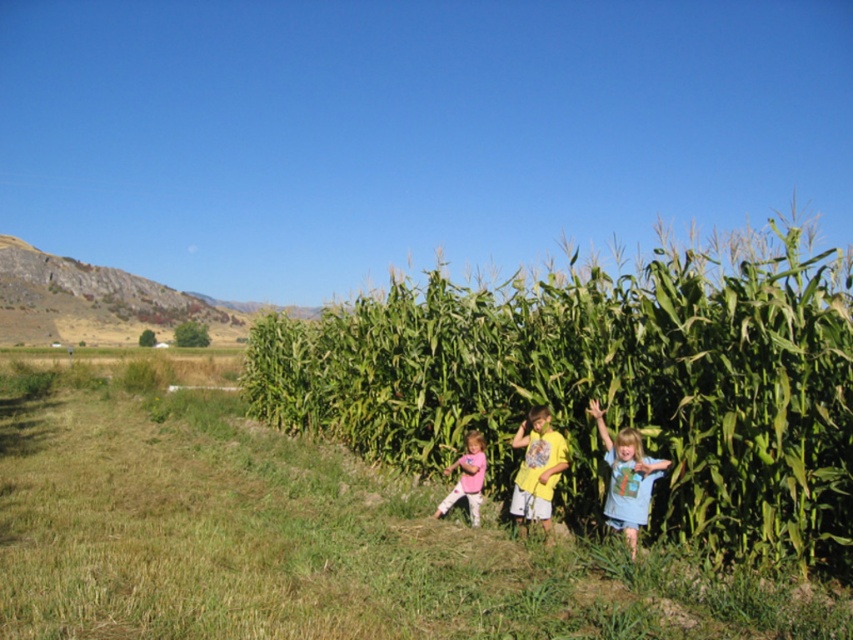
Between blue cotton shirt at right and yellow cotton shirt at center, which one is positioned lower?

Positioned lower is yellow cotton shirt at center.

Describe the element at coordinates (625, 477) in the screenshot. This screenshot has height=640, width=853. I see `blue cotton shirt at right` at that location.

Find the location of a particular element. This screenshot has width=853, height=640. blue cotton shirt at right is located at coordinates (625, 477).

Which of these two, green leafy corn at center or yellow cotton shirt at center, stands shorter?

yellow cotton shirt at center

Is point (788, 452) positioned behind point (526, 513)?

No, it is in front of (526, 513).

Does point (737, 554) come in front of point (514, 502)?

Yes.

You are a GUI agent. You are given a task and a screenshot of the screen. Output one action in this format:
    pyautogui.click(x=<x>, y=<y>)
    Task: Click on the green leafy corn at center
    The height and width of the screenshot is (640, 853).
    Given the screenshot: What is the action you would take?
    pyautogui.click(x=608, y=385)

Does point (122, 440) lie in front of point (526, 436)?

That is False.

Between green grass at lower center and yellow cotton shirt at center, which one is positioned lower?

green grass at lower center is below.

Between point (125, 500) and point (546, 522), which one is positioned behind?

Point (125, 500)

At what (x,y) coordinates should I click in order to perform the action: click on green grass at lower center. Please return your answer as a coordinate pair (x, y). Looking at the image, I should click on (302, 532).